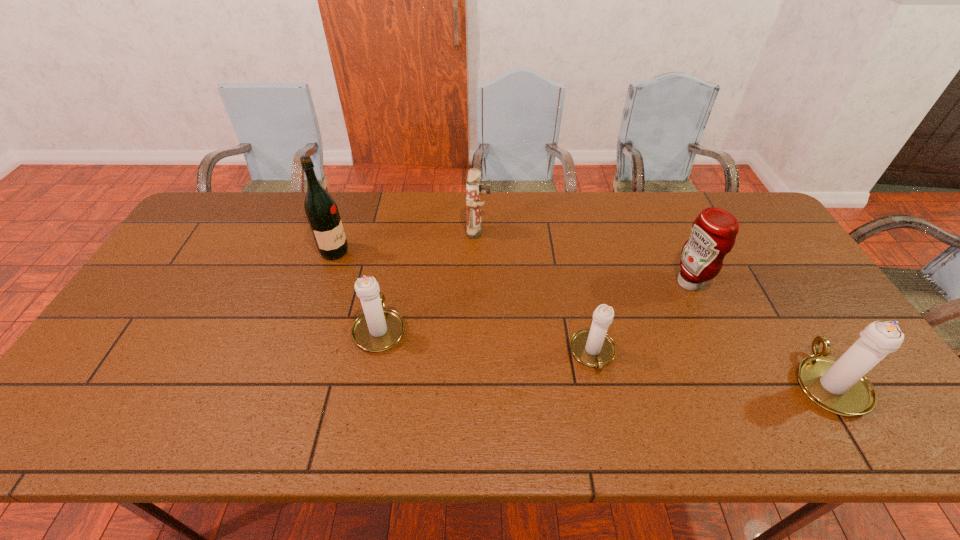
You are a GUI agent. You are given a task and a screenshot of the screen. Output one action in this format:
    pyautogui.click(x=<x>, y=<y>)
    Task: Click on the candle holder that is the second closest to the third object from left to right
    
    Given the screenshot: What is the action you would take?
    pyautogui.click(x=592, y=347)

Where is `free location that satisfies the following two spatial constraints: 1. on the front-facing side of the figurine; 2. on the handle side of the rightmost object`? The height and width of the screenshot is (540, 960). free location that satisfies the following two spatial constraints: 1. on the front-facing side of the figurine; 2. on the handle side of the rightmost object is located at coordinates (478, 382).

Locate an element on the screen. vacant space that satisfies the following two spatial constraints: 1. on the front-facing side of the tallest object; 2. on the handle side of the rightmost object is located at coordinates (291, 382).

Image resolution: width=960 pixels, height=540 pixels. I want to click on vacant position in the image that satisfies the following two spatial constraints: 1. on the front-facing side of the fifth nearest object; 2. on the handle side of the rightmost object, so click(x=291, y=382).

This screenshot has width=960, height=540. In order to click on free space that satisfies the following two spatial constraints: 1. on the front-facing side of the condiment; 2. on the left side of the tallest object in this screenshot , I will do `click(324, 283)`.

In order to click on free space that satisfies the following two spatial constraints: 1. on the handle side of the second object from right to left; 2. on the right side of the fifth object from right to left in this screenshot , I will do `click(389, 283)`.